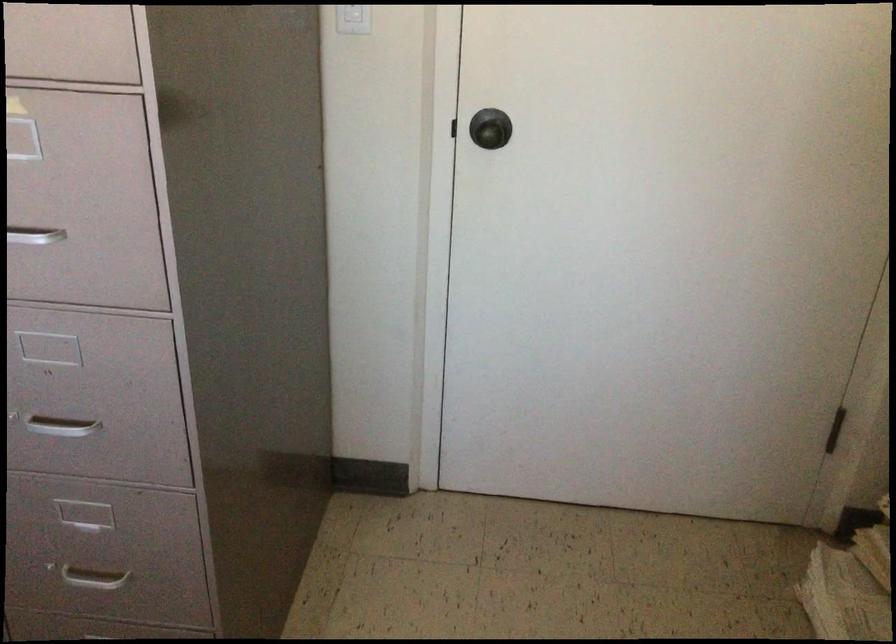
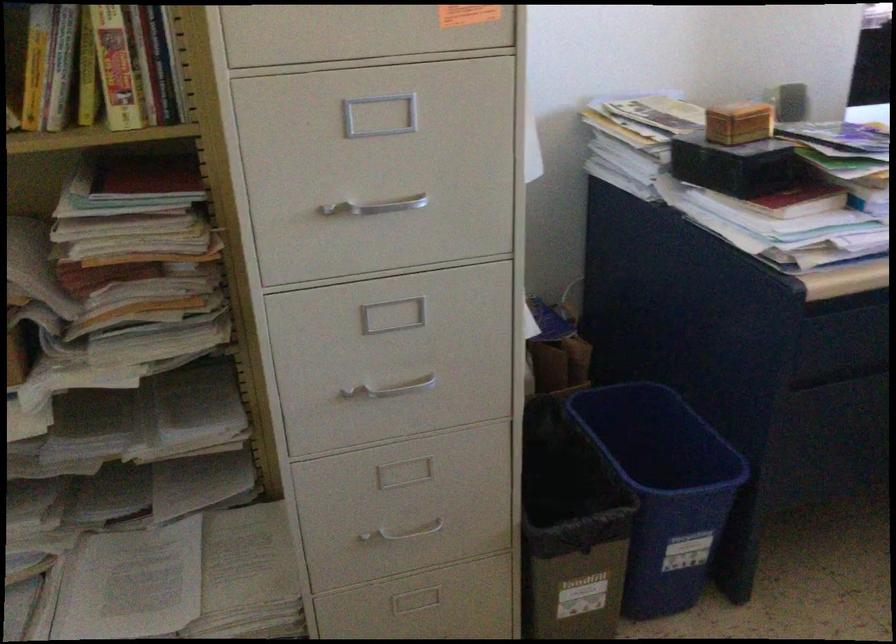
The first image is from the beginning of the video and the second image is from the end. How did the camera likely rotate when shooting the video?

The camera rotated toward right-down.